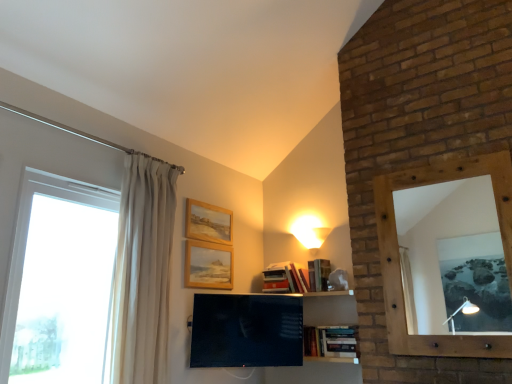
This screenshot has width=512, height=384. What are the coordinates of `free space above white glass window at left (from a real-world perspective)` in the screenshot? It's located at (72, 182).